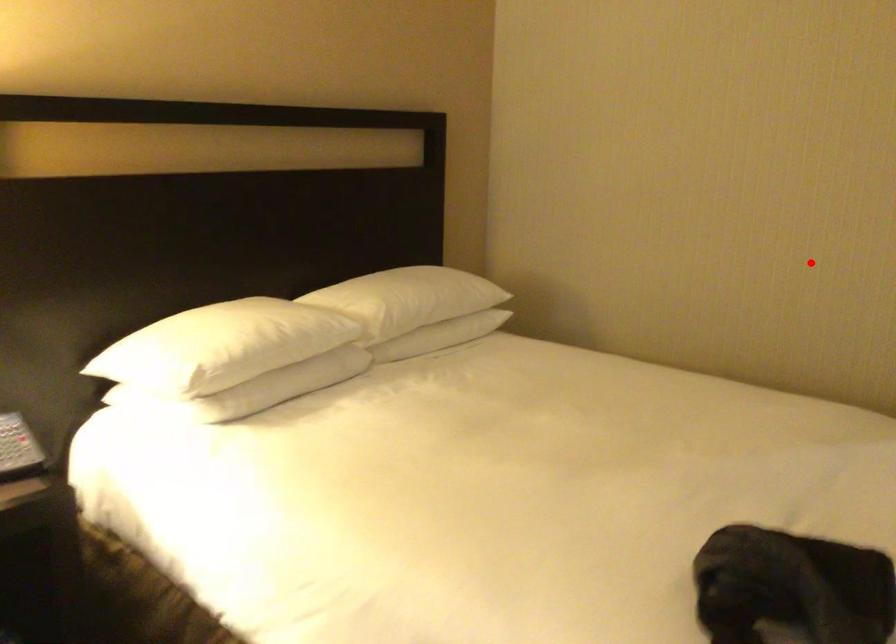
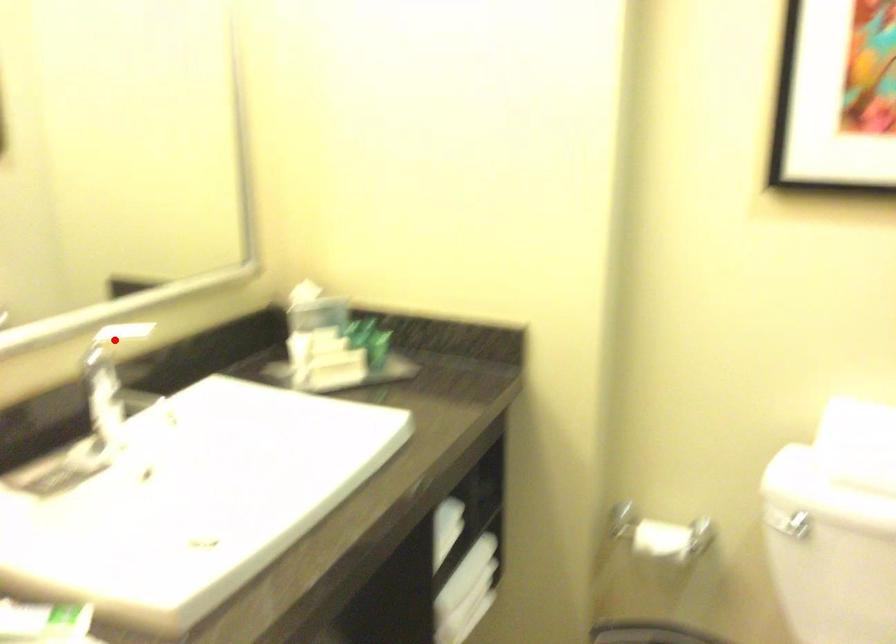
I am providing you with two images of the same scene from different viewpoints. A red point is marked on the first image and another point is marked on the second image. Is the red point in image1 aligned with the point shown in image2?

Yes